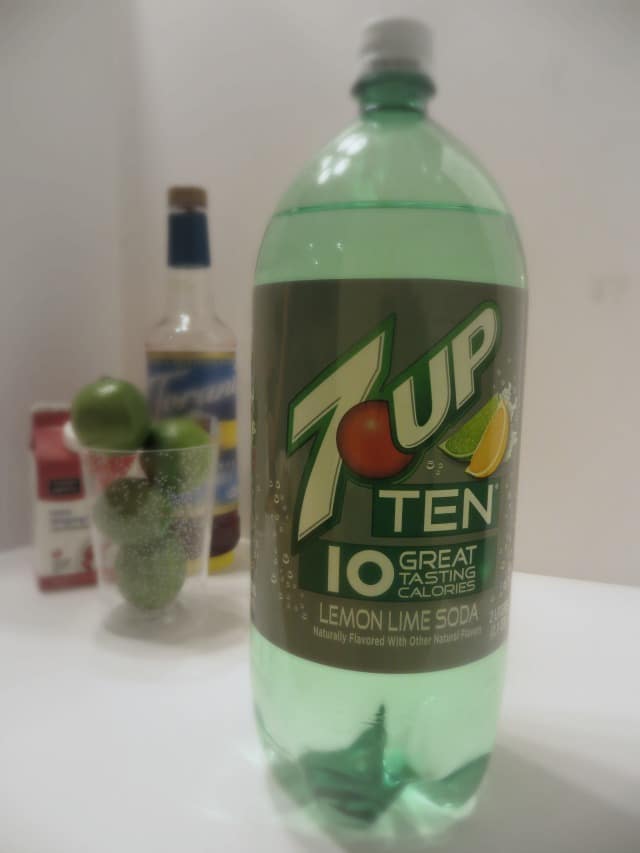
You are a GUI agent. You are given a task and a screenshot of the screen. Output one action in this format:
    pyautogui.click(x=<x>, y=<y>)
    Task: Click on the cup
    This screenshot has width=640, height=853.
    Given the screenshot: What is the action you would take?
    pyautogui.click(x=184, y=503)